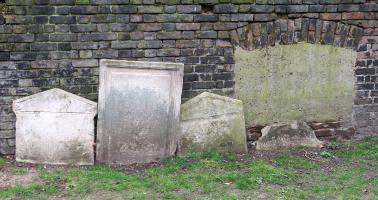
Image resolution: width=378 pixels, height=200 pixels. What are the coordinates of `1 hole on the right side of wall` in the screenshot? It's located at (286, 15).